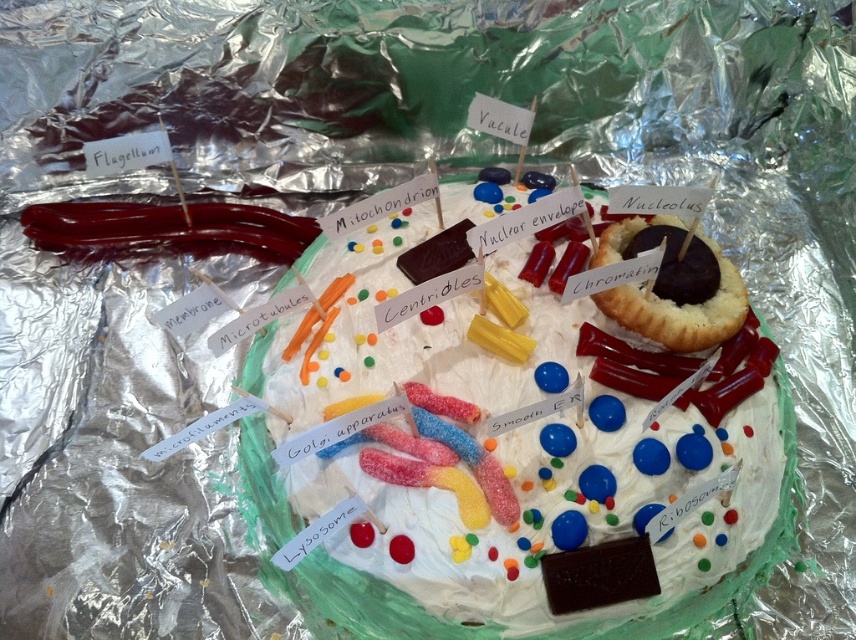
Question: Which point is farther to the camera?

Choices:
 (A) chocolate cake at upper right
 (B) smooth chocolate cake at center

Answer: (A)

Question: Which object appears farthest from the camera in this image?

Choices:
 (A) smooth chocolate cake at center
 (B) chocolate cake at upper right

Answer: (B)

Question: Is smooth chocolate cake at center wider than chocolate cake at upper right?

Choices:
 (A) no
 (B) yes

Answer: (B)

Question: Is smooth chocolate cake at center smaller than chocolate cake at upper right?

Choices:
 (A) no
 (B) yes

Answer: (A)

Question: Does smooth chocolate cake at center have a lesser width compared to chocolate cake at upper right?

Choices:
 (A) no
 (B) yes

Answer: (A)